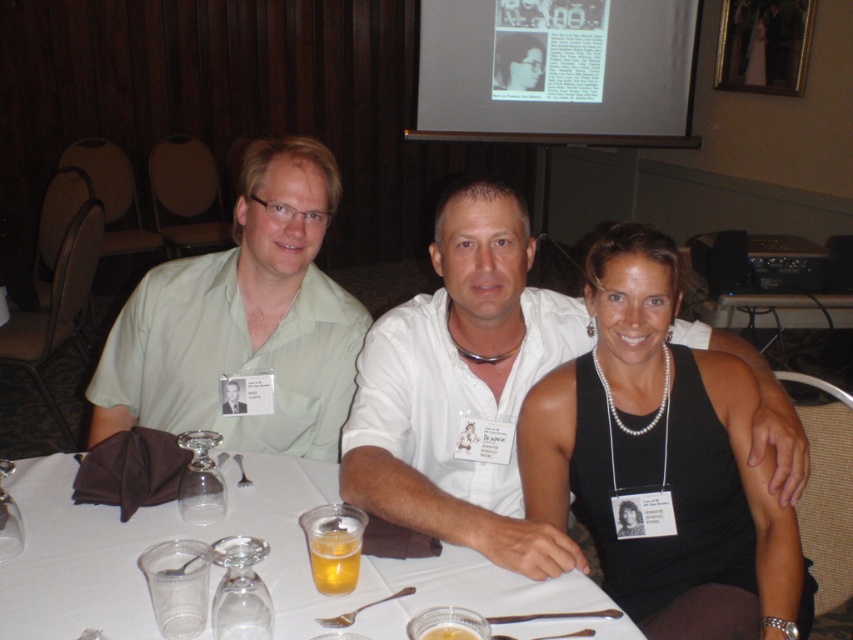
Which is below, green matte shirt at left or white paper table at center?

white paper table at center is lower down.

Is green matte shirt at left positioned before white paper table at center?

No.

Identify the location of green matte shirt at left. (242, 323).

Is point (628, 417) closer to viewer compared to point (283, 150)?

Yes.

From the picture: Who is shorter, black satin tank top at center or green matte shirt at left?

Standing shorter between the two is green matte shirt at left.

Is point (558, 368) farther from camera compared to point (128, 412)?

No, (558, 368) is closer to viewer.

At what (x,y) coordinates should I click in order to perform the action: click on black satin tank top at center. Please return your answer as a coordinate pair (x, y). This screenshot has height=640, width=853. Looking at the image, I should click on (659, 445).

Between black satin tank top at center and white paper table at center, which one is positioned lower?

Positioned lower is white paper table at center.

At what (x,y) coordinates should I click in order to perform the action: click on black satin tank top at center. Please return your answer as a coordinate pair (x, y). Looking at the image, I should click on (659, 445).

Where is `black satin tank top at center`? The image size is (853, 640). black satin tank top at center is located at coordinates (659, 445).